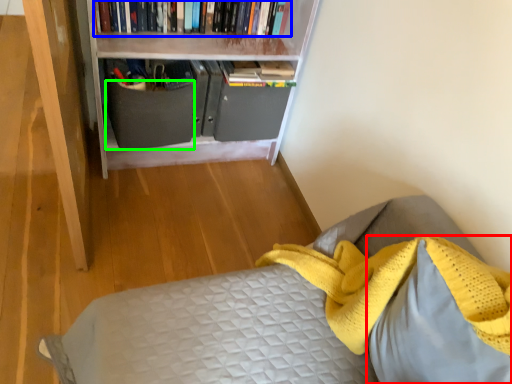
Question: Which object is positioned farthest from pillow (highlighted by a red box)? Select from book (highlighted by a blue box) and drawer (highlighted by a green box).

Choices:
 (A) book
 (B) drawer

Answer: (A)